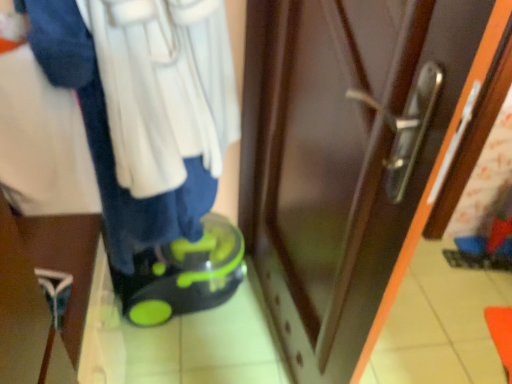
The width and height of the screenshot is (512, 384). In order to click on green rubber shoes at center in this screenshot , I will do `click(183, 275)`.

This screenshot has height=384, width=512. Describe the element at coordinates (183, 275) in the screenshot. I see `green rubber shoes at center` at that location.

The width and height of the screenshot is (512, 384). What are the coordinates of `green rubber shoes at center` in the screenshot? It's located at (183, 275).